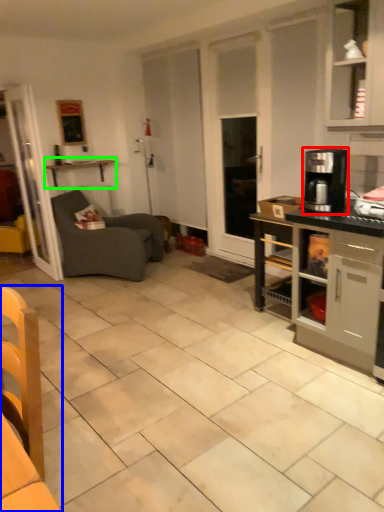
Question: Which object is the farthest from coffee maker (highlighted by a red box)? Choose among these: chair (highlighted by a blue box) or shelf (highlighted by a green box).

Choices:
 (A) chair
 (B) shelf

Answer: (B)